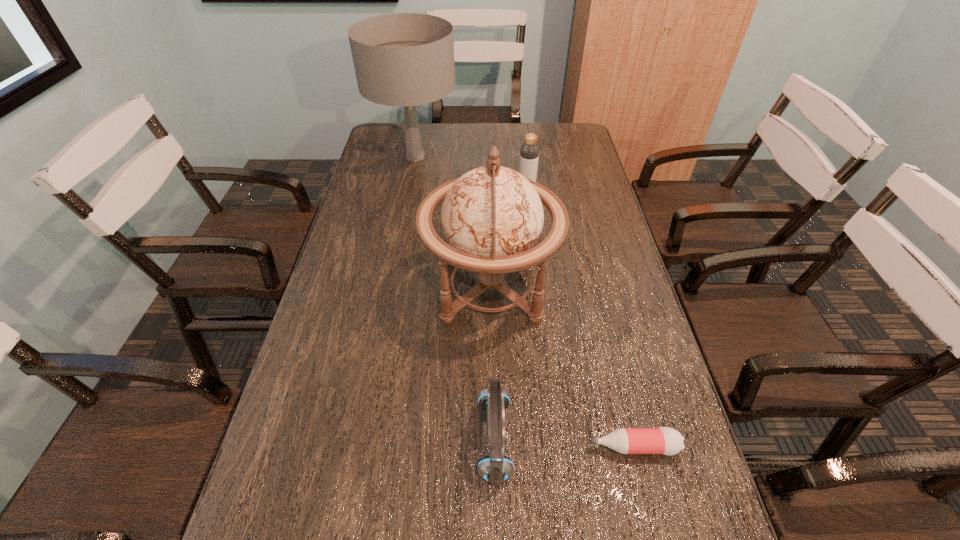
The height and width of the screenshot is (540, 960). Identify the location of the farthest object. (403, 59).

The height and width of the screenshot is (540, 960). Identify the location of the third nearest object. tap(492, 217).

The width and height of the screenshot is (960, 540). Find the location of `the farther bottle`. the farther bottle is located at coordinates (529, 152).

I want to click on the third tallest object, so click(x=529, y=152).

The width and height of the screenshot is (960, 540). I want to click on headset, so click(x=495, y=468).

This screenshot has width=960, height=540. I want to click on the right bottle, so tap(664, 440).

This screenshot has height=540, width=960. Find the location of `the rightmost object`. the rightmost object is located at coordinates (664, 440).

Locate an element on the screen. The image size is (960, 540). free space located on the front-facing side of the lampshade is located at coordinates (404, 214).

Identify the location of vacant space located on the front-facing side of the third farthest object. The height and width of the screenshot is (540, 960). (x=407, y=288).

Where is `vacant space situated 0.250m on the front-facing side of the third farthest object`? The height and width of the screenshot is (540, 960). vacant space situated 0.250m on the front-facing side of the third farthest object is located at coordinates (333, 288).